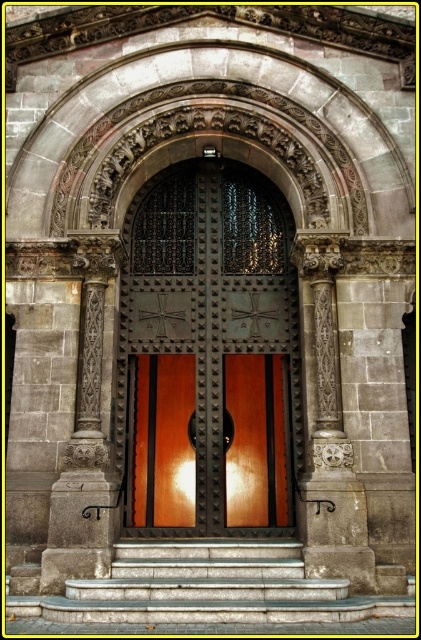
Is polished wood door at center thinner than smooth stone steps at center?

Yes.

Image resolution: width=421 pixels, height=640 pixels. Describe the element at coordinates (210, 353) in the screenshot. I see `polished wood door at center` at that location.

Where is `polished wood door at center`? The width and height of the screenshot is (421, 640). polished wood door at center is located at coordinates (210, 353).

Who is taller, glossy wood door at center or carved stone column at center?

carved stone column at center

Does glossy wood door at center have a greater height compared to carved stone column at center?

No.

What are the coordinates of `glossy wood door at center` in the screenshot? It's located at (255, 442).

Where is `polished wood door at center`? The height and width of the screenshot is (640, 421). polished wood door at center is located at coordinates (210, 353).

Does point (276, 284) lie in front of point (228, 470)?

No.

At what (x,y) coordinates should I click in order to perform the action: click on polished wood door at center. Please return your answer as a coordinate pair (x, y). The height and width of the screenshot is (640, 421). Looking at the image, I should click on (210, 353).